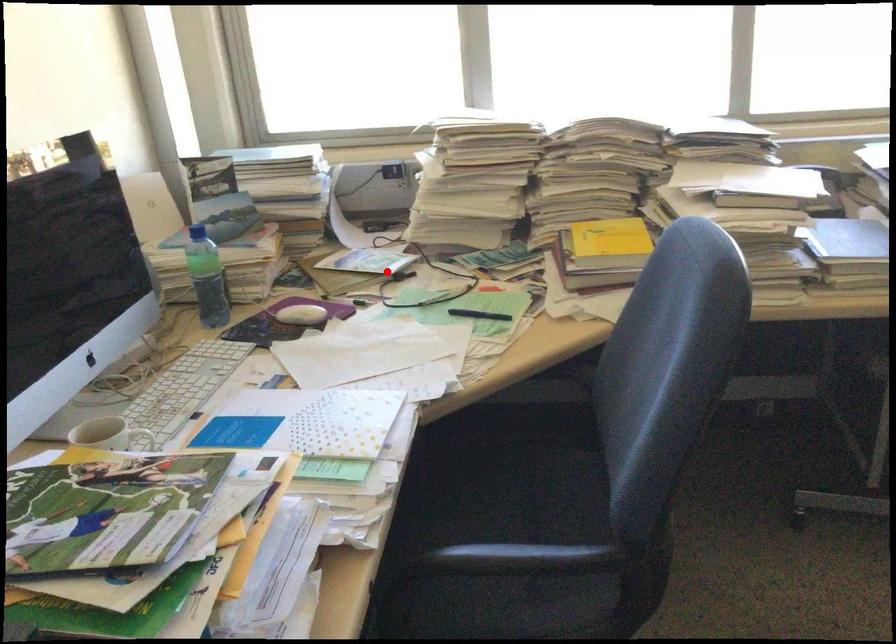
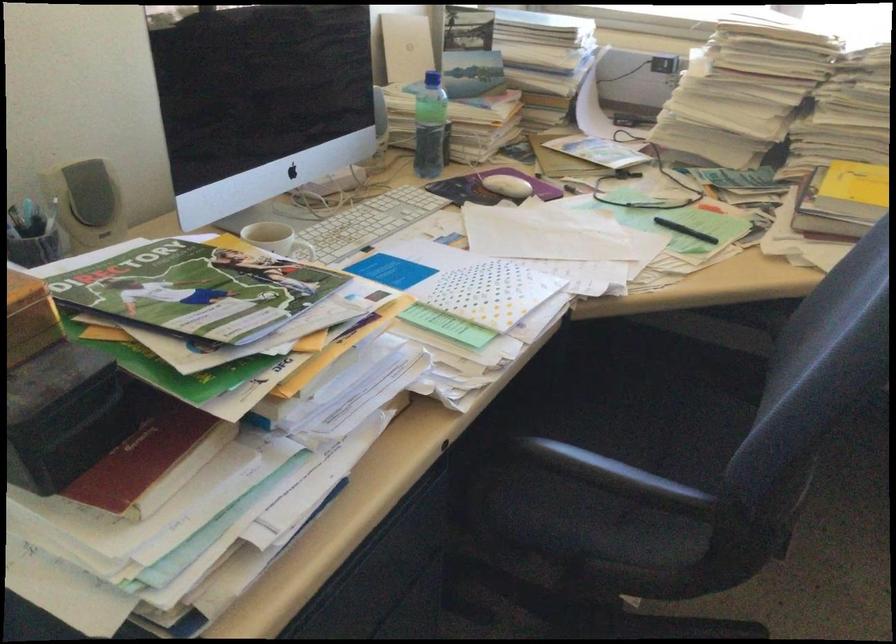
Find the pixel in the second image that matches the highlighted location in the first image.

(610, 166)